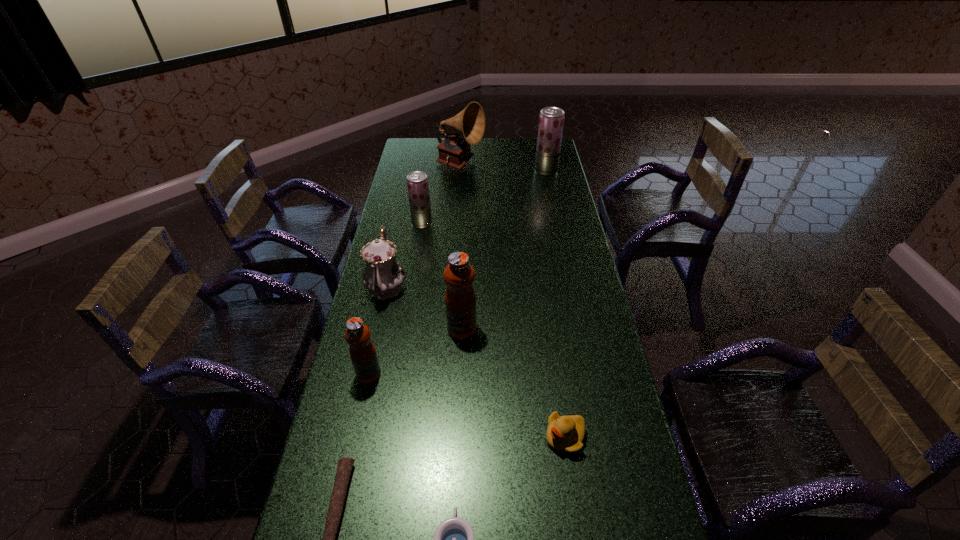
The height and width of the screenshot is (540, 960). Identify the location of free space located on the beak of the yellow duckling. (431, 437).

I want to click on object present at the far edge, so click(454, 151).

Locate an element on the screen. chinaware that is at the left edge is located at coordinates (383, 276).

Identify the location of fruit juice located in the right edge section of the desktop. (551, 120).

You are a GUI agent. You are given a task and a screenshot of the screen. Output one action in this format:
    pyautogui.click(x=<x>, y=<y>)
    Task: Click on the duckling that is at the right edge
    
    Given the screenshot: What is the action you would take?
    pyautogui.click(x=565, y=434)

Locate an element on the screen. The height and width of the screenshot is (540, 960). vacant space at the far edge of the desktop is located at coordinates (511, 156).

In the image, there is a desktop. Identify the location of free region at the left edge. The height and width of the screenshot is (540, 960). (411, 267).

You are a GUI agent. You are given a task and a screenshot of the screen. Output one action in this format:
    pyautogui.click(x=<x>, y=<y>)
    Task: Click on the free space at the right edge of the desktop
    The image size is (960, 540).
    Given the screenshot: What is the action you would take?
    pyautogui.click(x=564, y=184)

The width and height of the screenshot is (960, 540). In order to click on free space at the far right corner of the desktop in this screenshot , I will do `click(531, 144)`.

Locate an element on the screen. The image size is (960, 540). vacant space in between the yellow duckling and the third fruit juice from right to left is located at coordinates (493, 330).